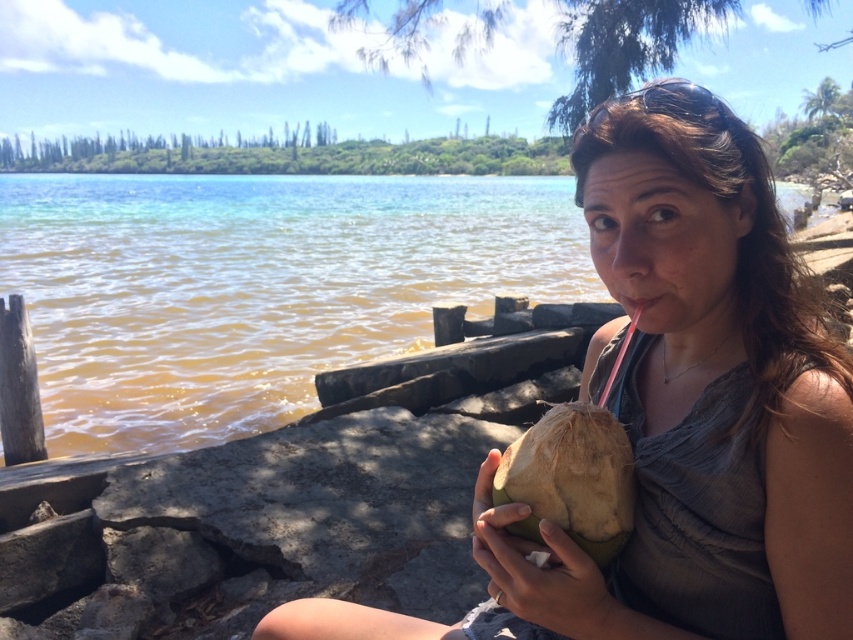
Is green rough coconut at center shorter than brown rough coconut at lower center?

In fact, green rough coconut at center may be taller than brown rough coconut at lower center.

Looking at this image, does green rough coconut at center appear over brown rough coconut at lower center?

No, green rough coconut at center is not above brown rough coconut at lower center.

Who is more forward, (705, 481) or (556, 500)?

Point (556, 500) is more forward.

Where is `green rough coconut at center`? The image size is (853, 640). green rough coconut at center is located at coordinates (682, 412).

Is point (523, 614) closer to camera compared to point (589, 584)?

No.

Which is behind, point (573, 160) or point (587, 612)?

The point (573, 160) is behind.

Does point (805, 538) come closer to viewer compared to point (534, 595)?

Yes, it is.

Where is `green rough coconut at center`? The image size is (853, 640). green rough coconut at center is located at coordinates (682, 412).

Is clear water at center below brown rough coconut at lower center?

Actually, clear water at center is above brown rough coconut at lower center.

How far apart are clear water at center and brown rough coconut at lower center?

clear water at center is 18.66 meters from brown rough coconut at lower center.

Find the location of `clear water at center`. clear water at center is located at coordinates (256, 288).

Identify the location of clear water at center. (256, 288).